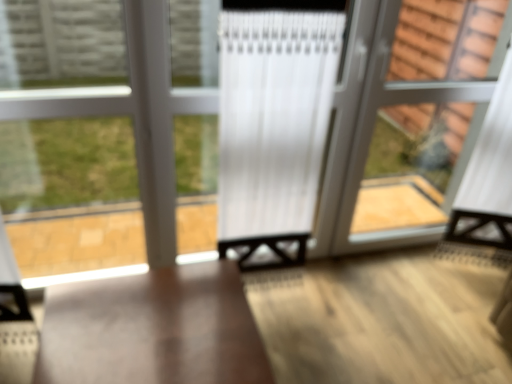
Question: Does clear glass bay window at left have a larger size compared to clear glass screen door at right?

Choices:
 (A) yes
 (B) no

Answer: (B)

Question: From the image's perspective, is clear glass bay window at left on top of clear glass screen door at right?

Choices:
 (A) yes
 (B) no

Answer: (B)

Question: Is clear glass bay window at left to the left of clear glass screen door at right from the viewer's perspective?

Choices:
 (A) no
 (B) yes

Answer: (B)

Question: Is clear glass bay window at left positioned before clear glass screen door at right?

Choices:
 (A) no
 (B) yes

Answer: (B)

Question: Is clear glass bay window at left surrounding clear glass screen door at right?

Choices:
 (A) yes
 (B) no

Answer: (B)

Question: Can you confirm if clear glass bay window at left is thinner than clear glass screen door at right?

Choices:
 (A) no
 (B) yes

Answer: (B)

Question: From a real-world perspective, is clear glass screen door at right under matte wood table at center?

Choices:
 (A) yes
 (B) no

Answer: (B)

Question: Is clear glass screen door at right at the left side of matte wood table at center?

Choices:
 (A) yes
 (B) no

Answer: (B)

Question: Is clear glass screen door at right directly adjacent to matte wood table at center?

Choices:
 (A) yes
 (B) no

Answer: (B)

Question: Is clear glass screen door at right oriented away from matte wood table at center?

Choices:
 (A) yes
 (B) no

Answer: (B)

Question: Is clear glass screen door at right not near matte wood table at center?

Choices:
 (A) no
 (B) yes

Answer: (B)

Question: Would you say matte wood table at center is part of clear glass screen door at right's contents?

Choices:
 (A) yes
 (B) no

Answer: (B)

Question: Considering the relative sizes of matte wood table at center and clear glass bay window at left in the image provided, is matte wood table at center bigger than clear glass bay window at left?

Choices:
 (A) no
 (B) yes

Answer: (B)